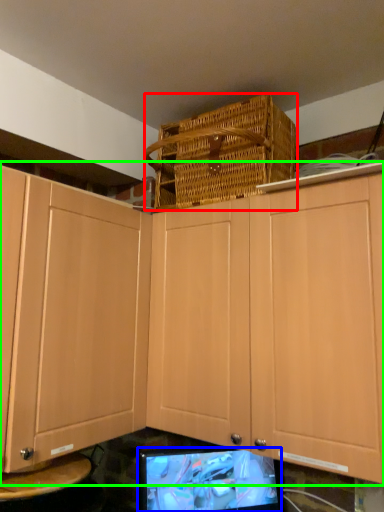
Question: Considering the real-world distances, which object is closest to basket (highlighted by a red box)? computer monitor (highlighted by a blue box) or cabinetry (highlighted by a green box).

Choices:
 (A) computer monitor
 (B) cabinetry

Answer: (B)